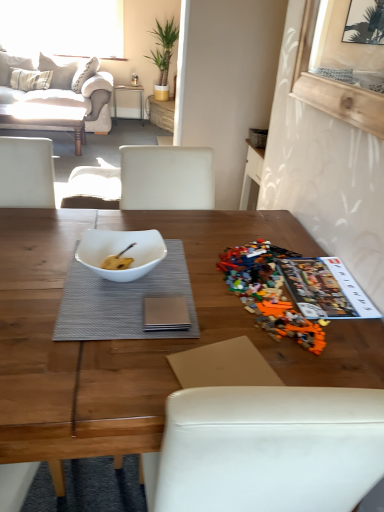
This screenshot has width=384, height=512. I want to click on empty space that is ontop of multicolored plastic lego set at right (from a real-world perspective), so click(283, 276).